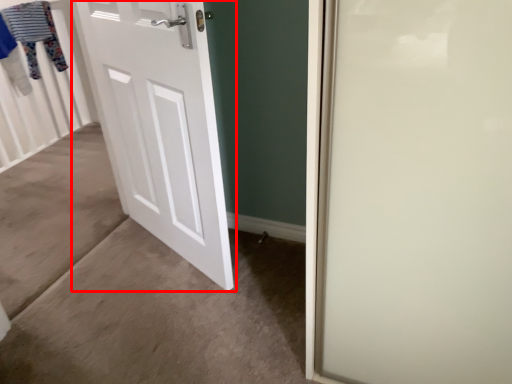
Question: Observing the image, what is the correct spatial positioning of door (annotated by the red box) in reference to clothesline?

Choices:
 (A) right
 (B) left

Answer: (A)